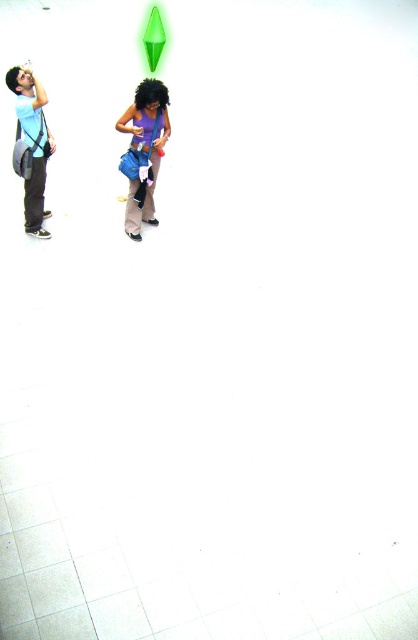
Does matte purple shirt at center come behind matte blue shirt at left?

Yes, matte purple shirt at center is further from the viewer.

Who is higher up, matte purple shirt at center or matte blue shirt at left?

Positioned higher is matte purple shirt at center.

Between point (145, 180) and point (35, 106), which one is positioned behind?

The point (145, 180) is more distant.

Identify the location of matte purple shirt at center. The height and width of the screenshot is (640, 418). (143, 150).